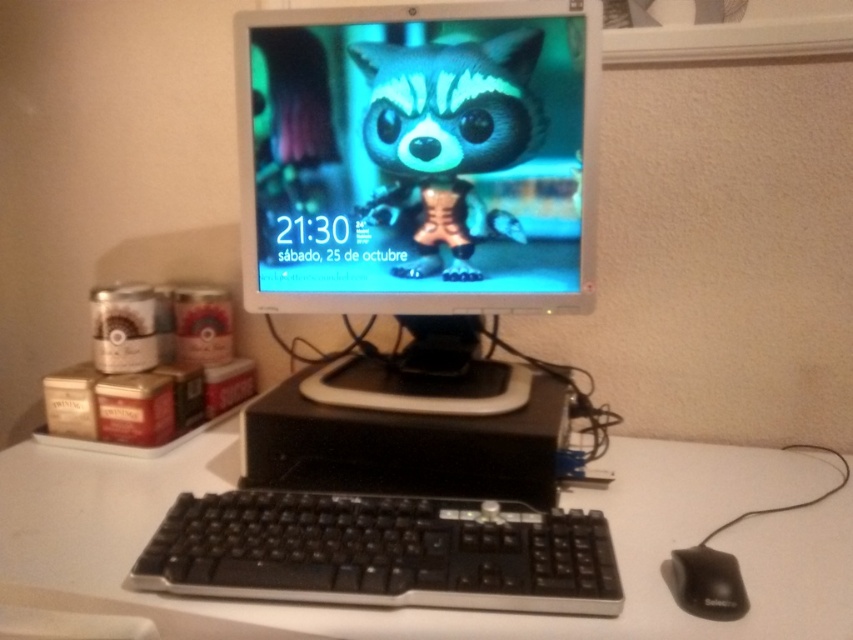
You are setting up a new lamp for your computer workstation. The lamp requires a surface that is at least 1 meter away from the CRT monitor to avoid interference. Given the coordinates of the white matte table at center, can you determine if placing the lamp there would be safe?

The white matte table at center is located at point (x=434, y=609), which is within the required distance from the CRT monitor. Therefore, placing the lamp there would be safe.

You are organizing a small party and need to place a 10cm tall candle on the white matte table at center. The black matte mouse at lower right is currently on the table. Can the candle be placed on the table without moving the mouse?

The white matte table at center has a larger size compared to black matte mouse at lower right, so there is enough space to place the candle on the table without moving the mouse.